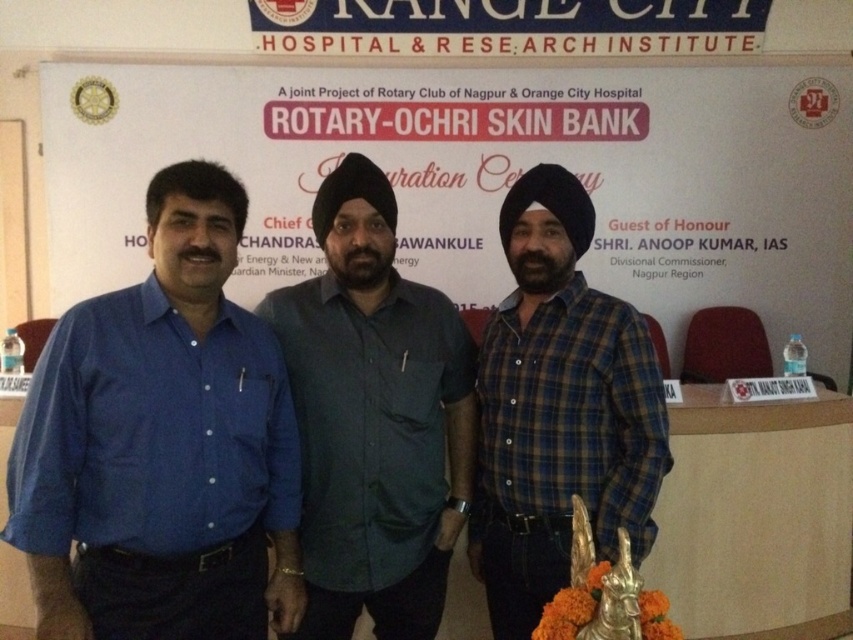
Question: Is matte blue shirt at left thinner than dark grey shirt at center?

Choices:
 (A) no
 (B) yes

Answer: (B)

Question: Does matte blue shirt at left appear on the left side of blue plaid shirt at center?

Choices:
 (A) yes
 (B) no

Answer: (A)

Question: Which of the following is the farthest from the observer?

Choices:
 (A) (428, 392)
 (B) (151, 611)
 (C) (531, 326)
 (D) (514, 100)

Answer: (D)

Question: Which point is closer to the camera taking this photo?

Choices:
 (A) (355, 244)
 (B) (413, 152)
 (C) (654, 397)

Answer: (C)

Question: Does white paper at center lie behind blue plaid shirt at center?

Choices:
 (A) yes
 (B) no

Answer: (A)

Question: Among these points, which one is nearest to the camera?

Choices:
 (A) (204, 624)
 (B) (405, 547)
 (C) (633, 410)

Answer: (A)